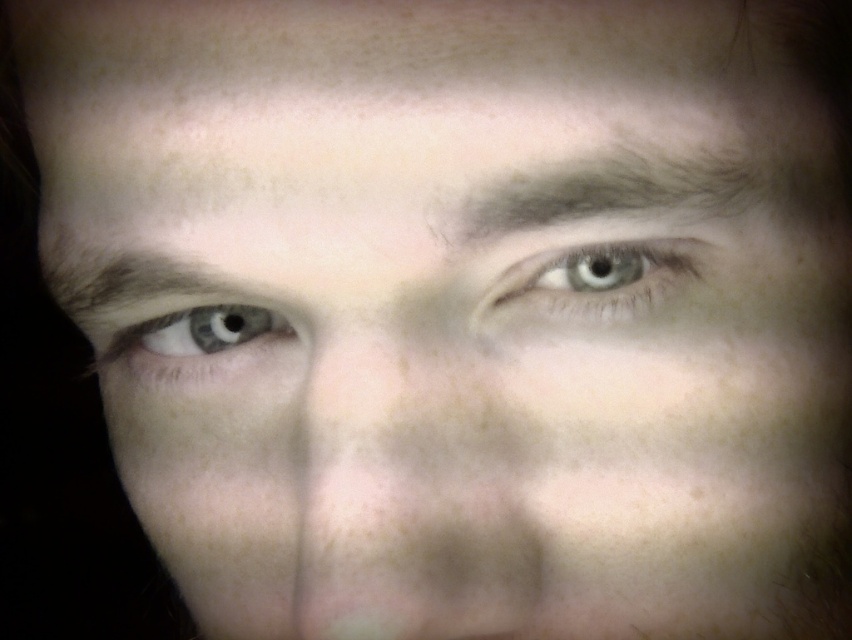
Who is shorter, smooth skin nose at center or blue glossy eye at left?

blue glossy eye at left is shorter.

Which is behind, point (435, 365) or point (170, 348)?

The point (170, 348) is behind.

The width and height of the screenshot is (852, 640). Find the location of `smooth skin nose at center`. smooth skin nose at center is located at coordinates (409, 496).

Does dark brown hair at upper center appear under brown matte eyebrow at upper left?

Actually, dark brown hair at upper center is above brown matte eyebrow at upper left.

Which is above, dark brown hair at upper center or brown matte eyebrow at upper left?

Positioned higher is dark brown hair at upper center.

Identify the location of dark brown hair at upper center. This screenshot has width=852, height=640. (620, 186).

Is smooth skin nose at center wider than brown matte eyebrow at upper left?

Correct, the width of smooth skin nose at center exceeds that of brown matte eyebrow at upper left.

Does point (461, 520) come in front of point (95, 285)?

Yes.

Find the location of a particular element. smooth skin nose at center is located at coordinates (409, 496).